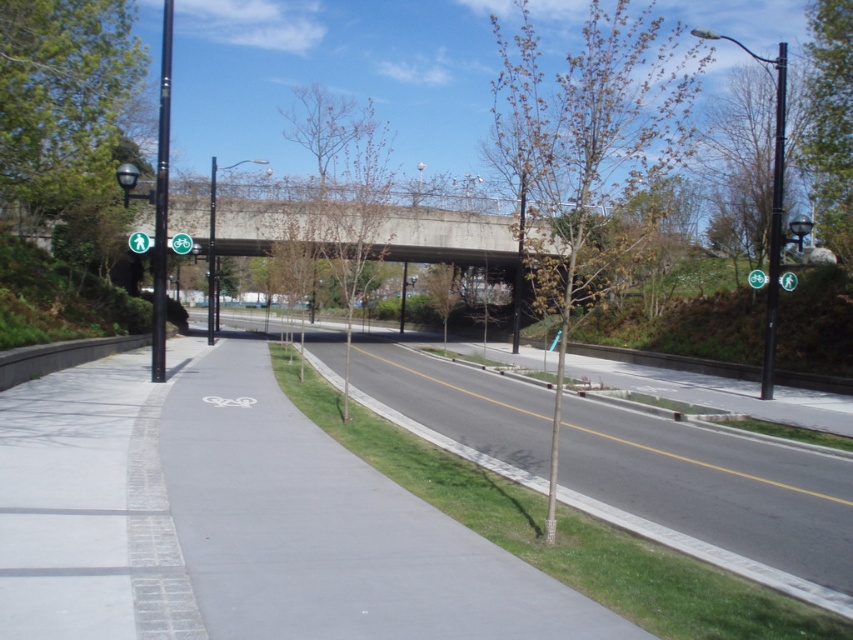
Locate an element on the screen. green plastic pedestrian sign at upper left is located at coordinates (138, 243).

Does green plastic pedestrian sign at upper left have a greater width compared to green plastic bicycle at center?

Yes, green plastic pedestrian sign at upper left is wider than green plastic bicycle at center.

Which is in front, point (134, 241) or point (192, 243)?

Positioned in front is point (134, 241).

Image resolution: width=853 pixels, height=640 pixels. I want to click on green plastic pedestrian sign at upper left, so click(138, 243).

The height and width of the screenshot is (640, 853). Describe the element at coordinates (775, 225) in the screenshot. I see `black metal pole at right` at that location.

Is black metal pole at right shorter than green plastic bicycle at upper center?

No.

I want to click on black metal pole at right, so pos(775,225).

Does metallic pole at center appear under green plastic pedestrian sign at upper left?

No, metallic pole at center is not below green plastic pedestrian sign at upper left.

Measure the distance between metallic pole at center and camera.

metallic pole at center and camera are 13.23 meters apart.

Which is behind, point (511, 349) or point (138, 236)?

Positioned behind is point (511, 349).

The image size is (853, 640). What are the coordinates of `metallic pole at center` in the screenshot? It's located at (518, 268).